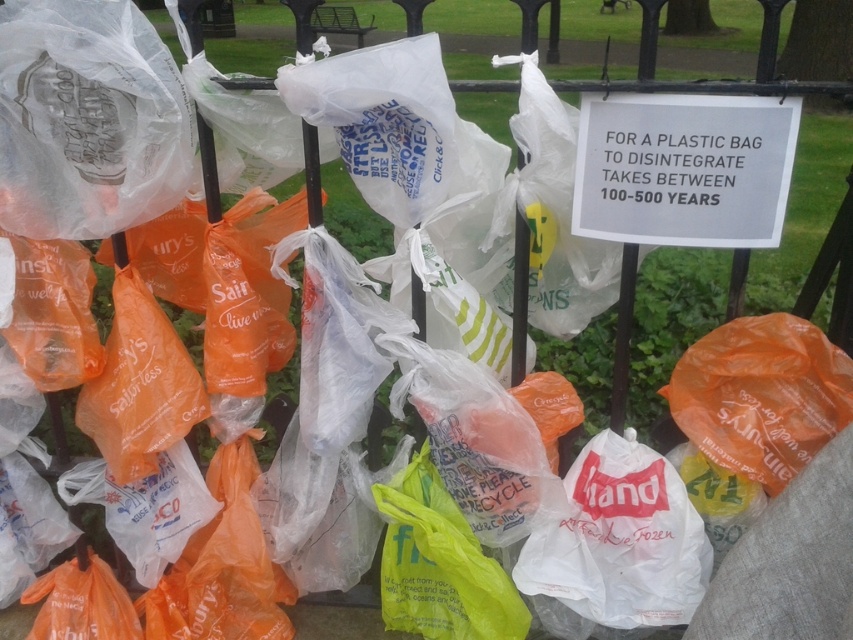
Question: Is white paper sign at upper center to the left of translucent yellow plastic bag at center from the viewer's perspective?

Choices:
 (A) yes
 (B) no

Answer: (B)

Question: Which point is closer to the camera?

Choices:
 (A) translucent yellow plastic bag at center
 (B) white paper sign at upper center

Answer: (B)

Question: Does white paper sign at upper center lie in front of translucent yellow plastic bag at center?

Choices:
 (A) yes
 (B) no

Answer: (A)

Question: Does white paper sign at upper center appear over translucent yellow plastic bag at center?

Choices:
 (A) no
 (B) yes

Answer: (B)